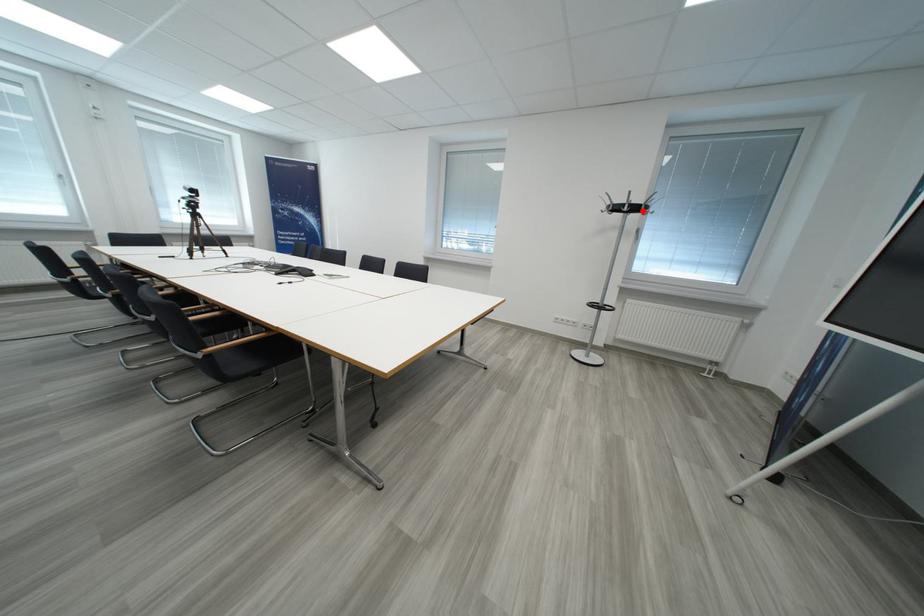
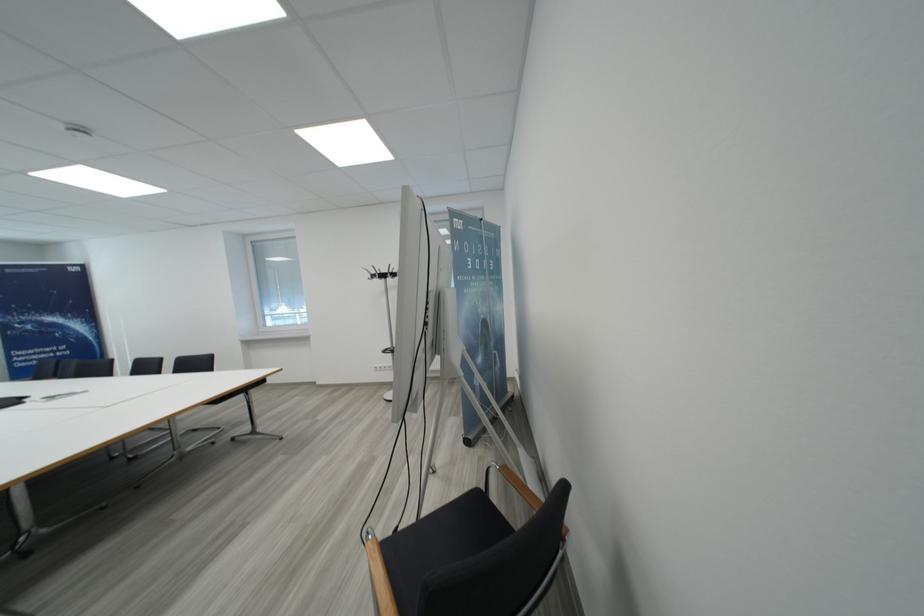
Find the pixel in the second image that matches the highlighted location in the first image.

(390, 278)